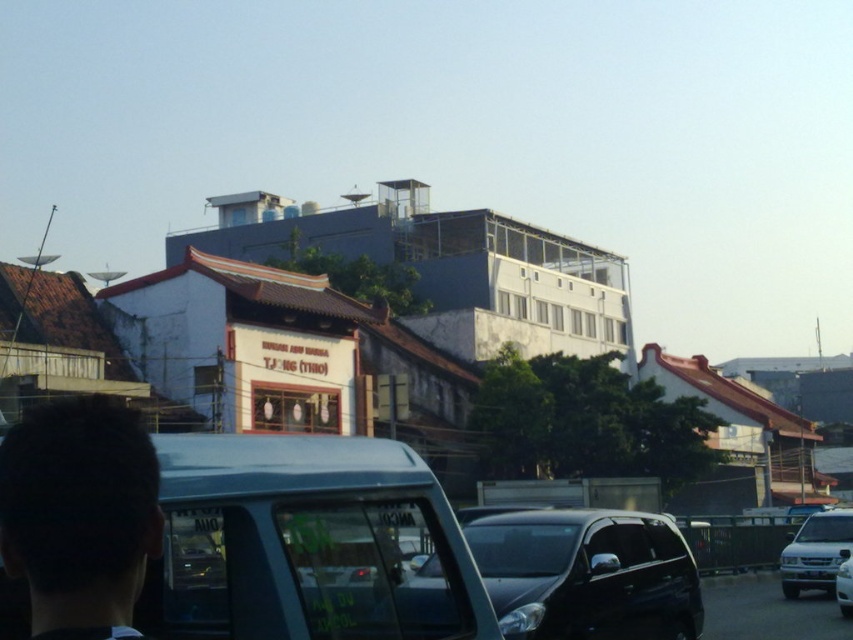
You are a pedestrian standing at the edge of the road and see the black glossy car at center and the white matte car at right. Which car is narrower in width?

The black glossy car at center is thinner than the white matte car at right, so the black glossy car at center is narrower in width.

You are a pedestrian standing on the sidewalk. You see a black glossy car at center and a white glossy car at center in the road. If the distance between them is 7.57 meters, can you safely cross the road between them without getting hit?

The black glossy car at center and white glossy car at center are 7.57 meters apart. Since the distance between them is sufficient for a pedestrian to cross safely, you can cross the road between them without getting hit.